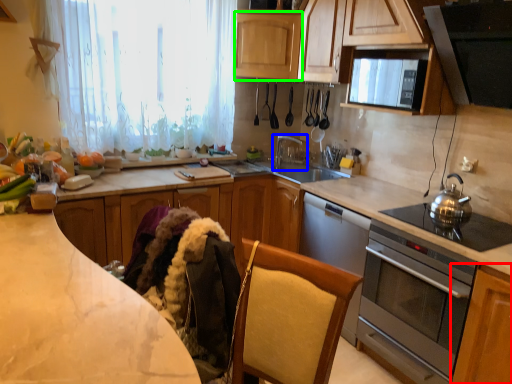
Question: Which object is positioned farthest from cabinetry (highlighted by a red box)? Select from tap (highlighted by a blue box) and cabinetry (highlighted by a green box).

Choices:
 (A) tap
 (B) cabinetry

Answer: (B)